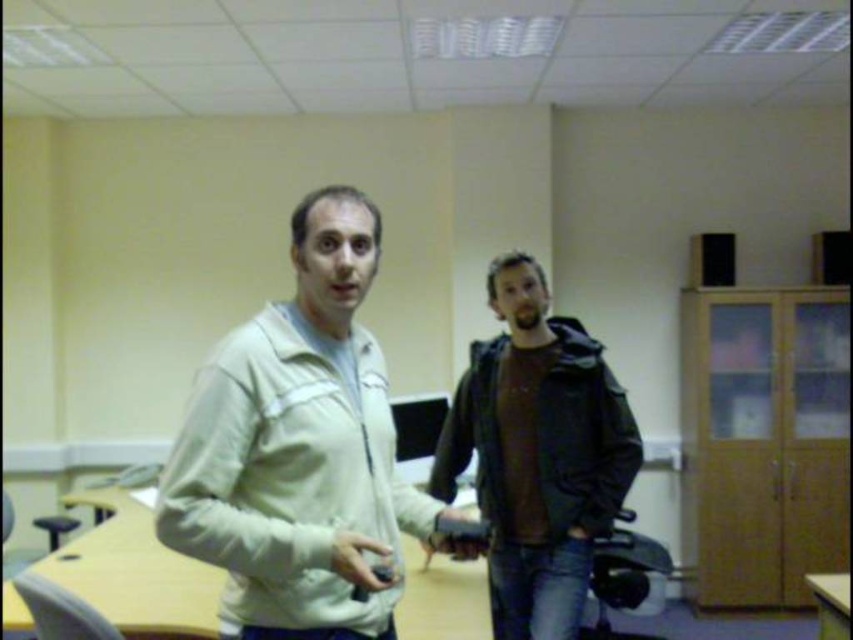
Question: Is light beige jacket at center to the right of dark brown leather jacket at center from the viewer's perspective?

Choices:
 (A) no
 (B) yes

Answer: (A)

Question: Does light beige jacket at center appear on the left side of dark brown leather jacket at center?

Choices:
 (A) no
 (B) yes

Answer: (B)

Question: Is light beige jacket at center positioned in front of dark brown leather jacket at center?

Choices:
 (A) no
 (B) yes

Answer: (B)

Question: Among these objects, which one is nearest to the camera?

Choices:
 (A) dark brown leather jacket at center
 (B) light beige jacket at center

Answer: (B)